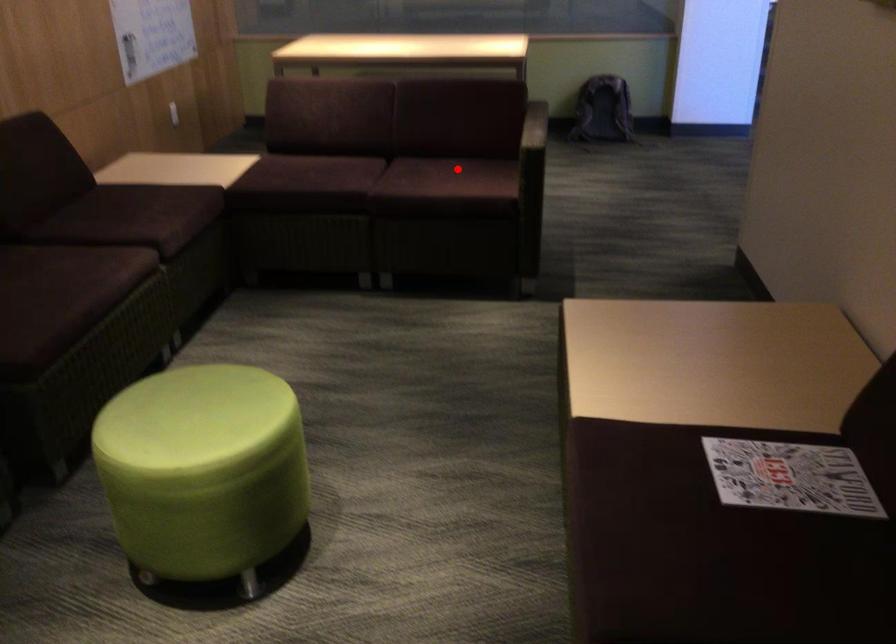
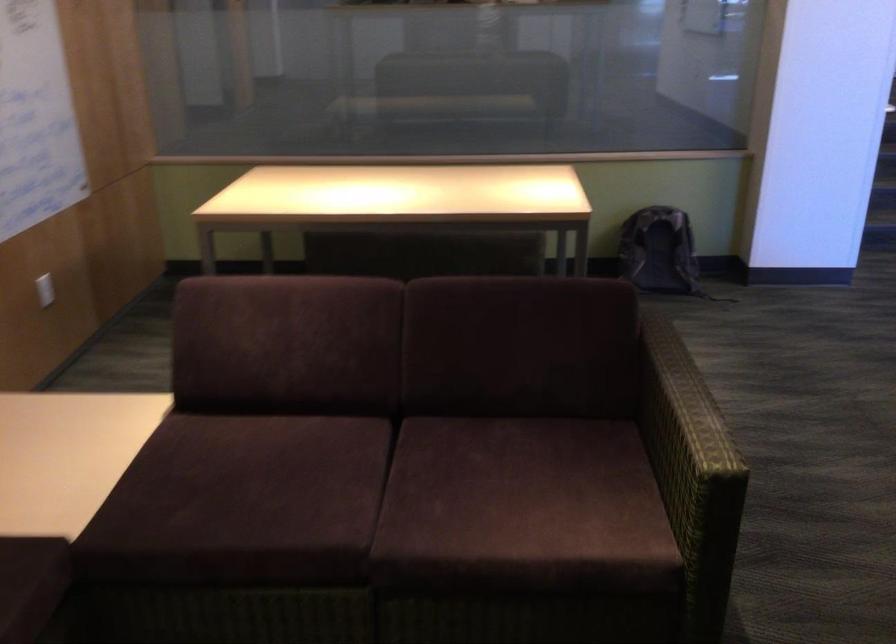
Question: I am providing you with two images of the same scene from different viewpoints. A red point is shown in image1. For the corresponding object point in image2, is it positioned nearer or farther from the camera?

Choices:
 (A) Nearer
 (B) Farther

Answer: (A)